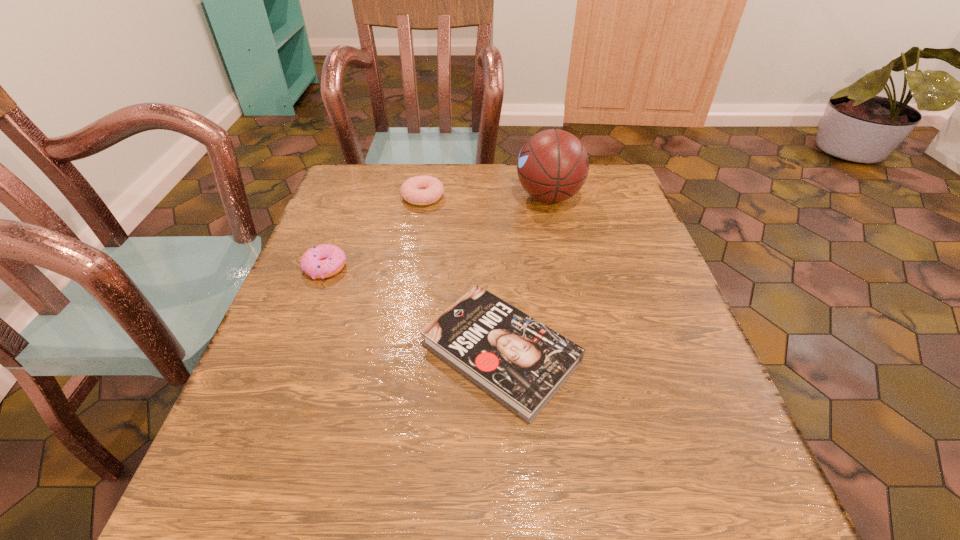
In order to click on free area in between the basketball and the shortest object in this screenshot , I will do `click(524, 275)`.

Select which object is the closest to the book. Please provide its 2D coordinates. Your answer should be formatted as a tuple, i.e. [(x, y)], where the tuple contains the x and y coordinates of a point satisfying the conditions above.

[(322, 261)]

I want to click on the second closest object to the leftmost object, so click(419, 190).

Locate an element on the screen. The image size is (960, 540). vacant space that satisfies the following two spatial constraints: 1. on the back side of the tallest object; 2. on the left side of the right doughnut is located at coordinates (423, 197).

Where is `free space that satisfies the following two spatial constraints: 1. on the back side of the left doughnut; 2. on the right side of the right doughnut`? free space that satisfies the following two spatial constraints: 1. on the back side of the left doughnut; 2. on the right side of the right doughnut is located at coordinates (352, 197).

I want to click on free spot that satisfies the following two spatial constraints: 1. on the back side of the nearer doughnut; 2. on the right side of the basketball, so [x=352, y=197].